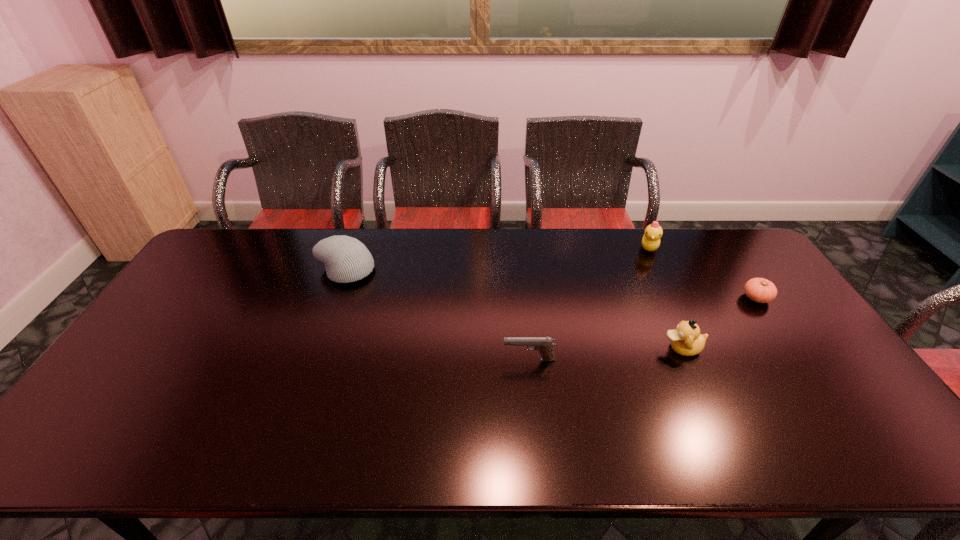
Find the location of a particular element. The height and width of the screenshot is (540, 960). free space located 0.300m on the face of the nearer duckling is located at coordinates (553, 348).

Where is `free space located on the face of the nearer duckling`? free space located on the face of the nearer duckling is located at coordinates (644, 348).

Locate an element on the screen. The image size is (960, 540). free space located 0.270m at the barrel of the pistol is located at coordinates (403, 360).

At what (x,y) coordinates should I click in order to perform the action: click on vacant region located at the barrel of the pistol. Please return your answer as a coordinate pair (x, y). Looking at the image, I should click on (469, 360).

What are the coordinates of `vacant space located at the barrel of the pistol` in the screenshot? It's located at (425, 360).

You are a GUI agent. You are given a task and a screenshot of the screen. Output one action in this format:
    pyautogui.click(x=<x>, y=<y>)
    Task: Click on the vacant space located on the left of the rightmost object
    The width and height of the screenshot is (960, 540).
    Given the screenshot: What is the action you would take?
    pyautogui.click(x=701, y=298)

Locate an element on the screen. The height and width of the screenshot is (540, 960). beanie at the far edge is located at coordinates (346, 259).

Where is `duckling that is at the far edge`? The width and height of the screenshot is (960, 540). duckling that is at the far edge is located at coordinates (651, 239).

At what (x,y) coordinates should I click in order to perform the action: click on object present at the right edge. Please return your answer as a coordinate pair (x, y). The height and width of the screenshot is (540, 960). Looking at the image, I should click on (760, 290).

Locate an element on the screen. vacant space at the far edge of the desktop is located at coordinates (520, 249).